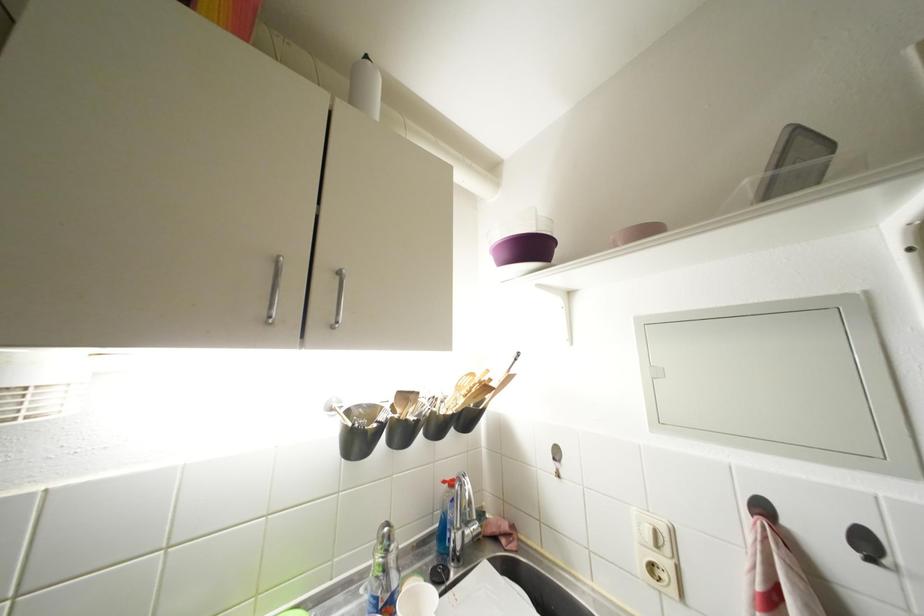
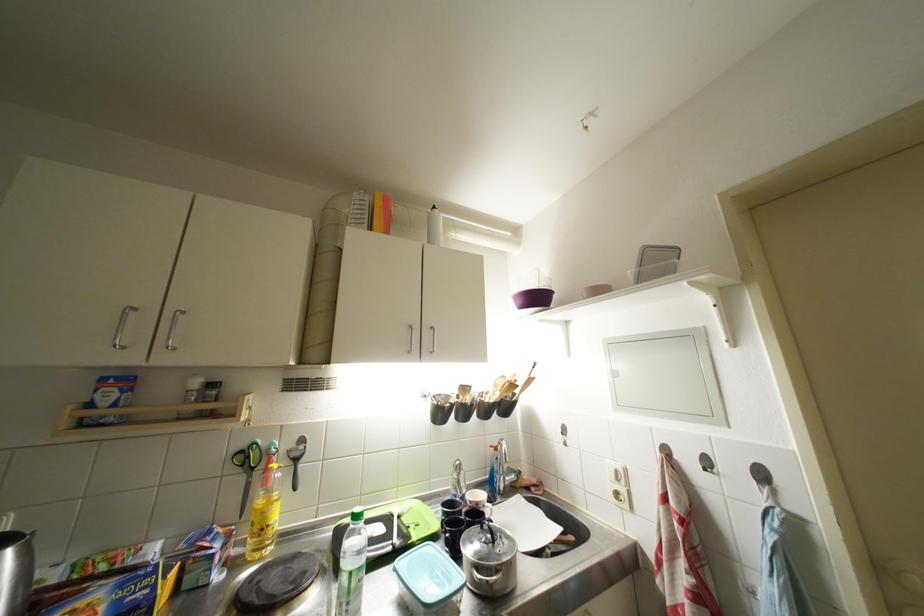
Find the pixel in the second image that matches the point at 871,548 in the first image.

(714, 467)